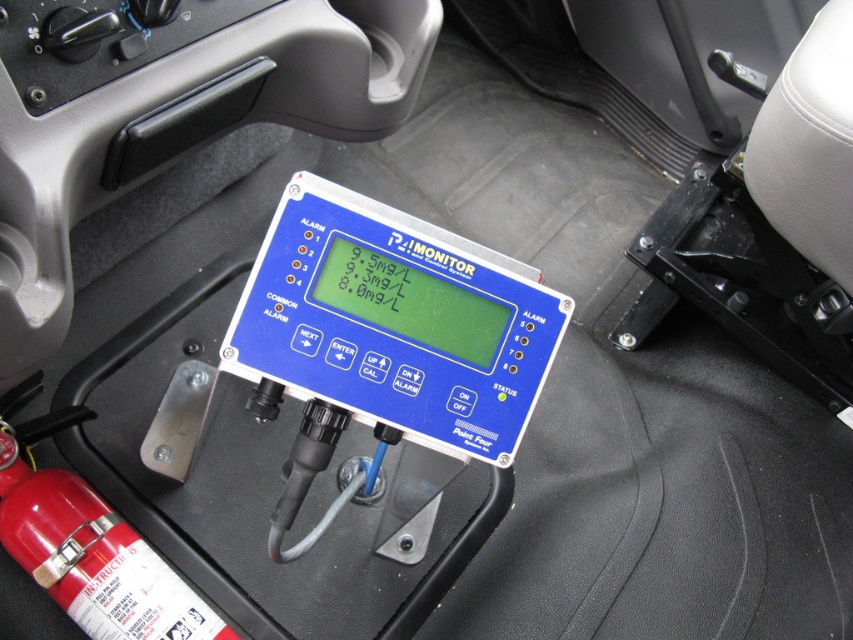
Question: Can you confirm if blue plastic monitor at center is positioned above red matte fire extinguisher at lower left?

Choices:
 (A) yes
 (B) no

Answer: (A)

Question: Is blue plastic monitor at center below red matte fire extinguisher at lower left?

Choices:
 (A) yes
 (B) no

Answer: (B)

Question: Is blue plastic monitor at center thinner than red matte fire extinguisher at lower left?

Choices:
 (A) no
 (B) yes

Answer: (A)

Question: Which object is farther from the camera taking this photo?

Choices:
 (A) red matte fire extinguisher at lower left
 (B) blue plastic monitor at center

Answer: (A)